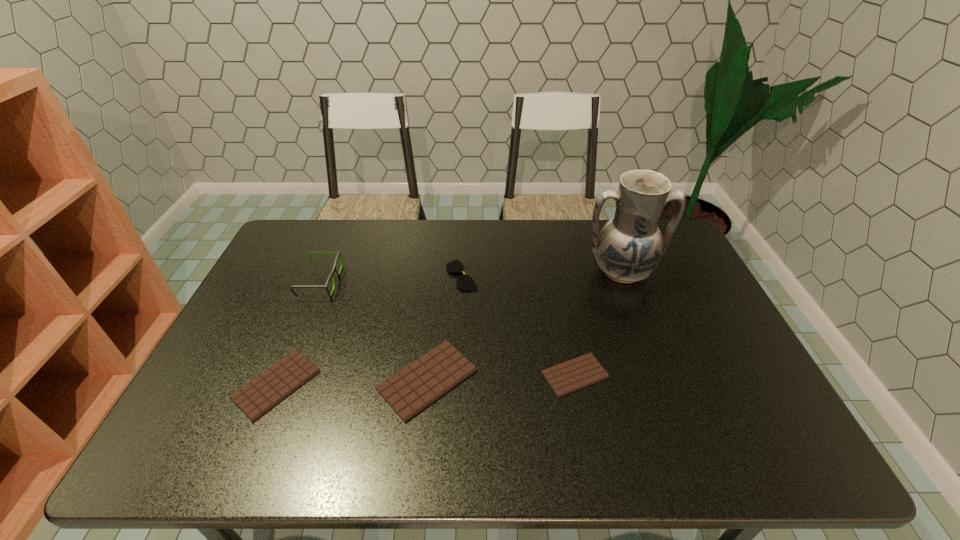
Find the location of a particular element. vacant space in between the shorter spectacles and the leftmost chocolate bar is located at coordinates (370, 330).

Locate an element on the screen. The width and height of the screenshot is (960, 540). free space that is in between the shortest chocolate bar and the taller spectacles is located at coordinates (447, 328).

This screenshot has width=960, height=540. Find the location of `unoccupied area between the shorter spectacles and the left spectacles`. unoccupied area between the shorter spectacles and the left spectacles is located at coordinates (391, 279).

The image size is (960, 540). What are the coordinates of `blank region between the fifth shortest object and the right spectacles` in the screenshot? It's located at (391, 279).

This screenshot has height=540, width=960. In order to click on the third closest object relative to the fifth shortest object in this screenshot , I will do `click(465, 282)`.

Choose which object is the third nearest neighbor to the fifth shortest object. Please provide its 2D coordinates. Your answer should be formatted as a tuple, i.e. [(x, y)], where the tuple contains the x and y coordinates of a point satisfying the conditions above.

[(465, 282)]

Where is `chocolate bar object that ranks as the closest to the second chocolate bar from left to right`? The image size is (960, 540). chocolate bar object that ranks as the closest to the second chocolate bar from left to right is located at coordinates (258, 396).

This screenshot has width=960, height=540. Find the location of `chocolate bar that is the third closest to the left spectacles`. chocolate bar that is the third closest to the left spectacles is located at coordinates (572, 375).

This screenshot has height=540, width=960. Find the location of `vacant area that satisfies the following two spatial constraints: 1. on the back side of the leftmost chocolate bar; 2. on the left side of the second object from right to left`. vacant area that satisfies the following two spatial constraints: 1. on the back side of the leftmost chocolate bar; 2. on the left side of the second object from right to left is located at coordinates (280, 375).

You are a GUI agent. You are given a task and a screenshot of the screen. Output one action in this format:
    pyautogui.click(x=<x>, y=<y>)
    Task: Click on the vacant space that satisfies the following two spatial constraints: 1. on the front-facing side of the rightmost object; 2. on the lens of the fifth shortest object
    This screenshot has width=960, height=540.
    Given the screenshot: What is the action you would take?
    pyautogui.click(x=625, y=282)